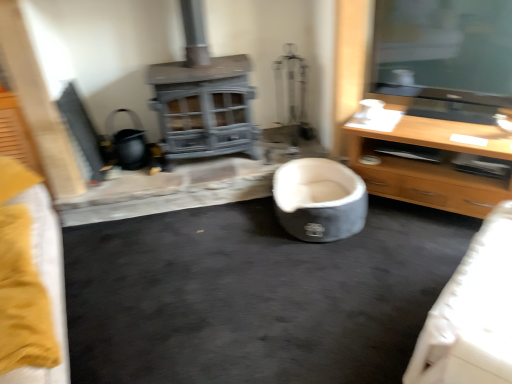
This screenshot has height=384, width=512. What are the coordinates of `vacant space in front of soft gray fabric bean bag at center` in the screenshot? It's located at (330, 270).